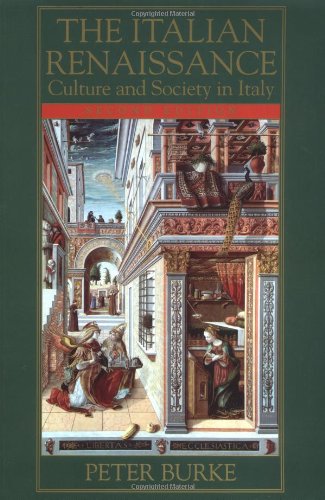
Where is `tile floor`? The image size is (325, 500). tile floor is located at coordinates (113, 418).